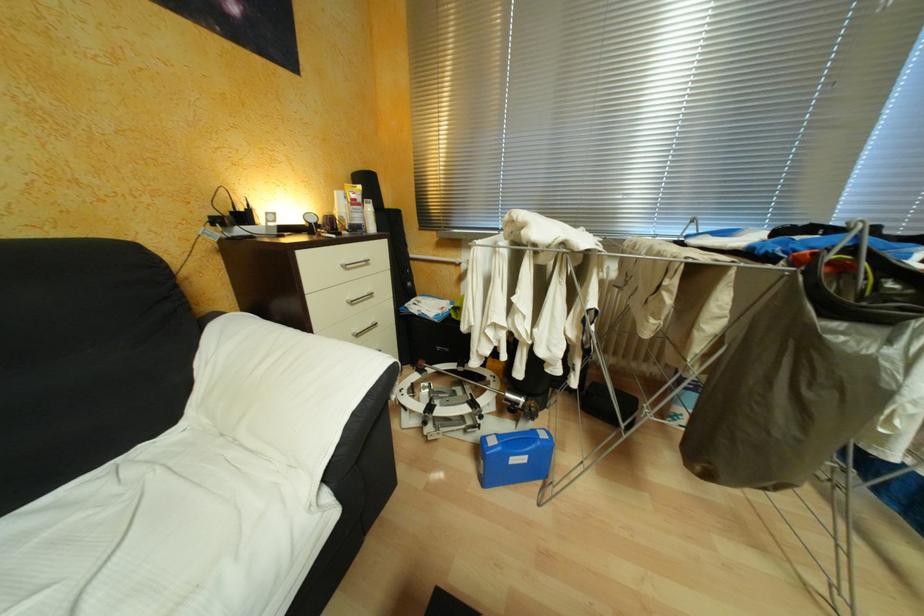
Where is `green hanging bag`? green hanging bag is located at coordinates (865, 286).